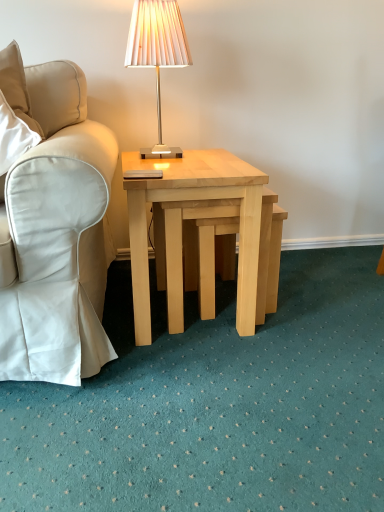
Find the location of a particular element. white fabric chair at left is located at coordinates (55, 228).

What do you see at coordinates (215, 258) in the screenshot?
I see `natural wood stool at center` at bounding box center [215, 258].

Measure the distance between light wood/natural wood coffee table at center and camera.

light wood/natural wood coffee table at center and camera are 3.74 feet apart from each other.

Where is `white fabric chair at left`? white fabric chair at left is located at coordinates (55, 228).

In the scene shown: Is matte beige lamp at upper center thinner than natural wood stool at center?

Yes, matte beige lamp at upper center is thinner than natural wood stool at center.

Visually, is matte beige lamp at upper center positioned to the left or to the right of natural wood stool at center?

In the image, matte beige lamp at upper center appears on the left side of natural wood stool at center.

Where is `lamp to the left of natural wood stool at center`? lamp to the left of natural wood stool at center is located at coordinates (157, 52).

From the image's perspective, which one is positioned higher, natural wood stool at center or white fabric chair at left?

white fabric chair at left, from the image's perspective.

Looking at this image, can you confirm if natural wood stool at center is positioned to the left of white fabric chair at left?

Incorrect, natural wood stool at center is not on the left side of white fabric chair at left.

Would you say natural wood stool at center is inside or outside white fabric chair at left?

natural wood stool at center is not inside white fabric chair at left, it's outside.

You are a GUI agent. You are given a task and a screenshot of the screen. Output one action in this format:
    pyautogui.click(x=<x>, y=<y>)
    Task: Click on the chair positioned vertically above the natural wood stool at center (from a real-world perspective)
    The width and height of the screenshot is (384, 512).
    Given the screenshot: What is the action you would take?
    pyautogui.click(x=55, y=228)

Is light wood/natural wood coffee table at center at the back of natural wood stool at center?

Yes.

From the picture: From the image's perspective, between natural wood stool at center and light wood/natural wood coffee table at center, which one is located above?

From the image's view, light wood/natural wood coffee table at center is above.

Locate an element on the screen. This screenshot has width=384, height=512. lamp above the light wood/natural wood coffee table at center (from the image's perspective) is located at coordinates (157, 52).

Is point (167, 41) farther from viewer compared to point (176, 167)?

Yes, it is.

Considering the sizes of objects matte beige lamp at upper center and light wood/natural wood coffee table at center in the image provided, who is bigger, matte beige lamp at upper center or light wood/natural wood coffee table at center?

Bigger between the two is light wood/natural wood coffee table at center.

From a real-world perspective, who is located higher, light wood/natural wood coffee table at center or matte beige lamp at upper center?

matte beige lamp at upper center, from a real-world perspective.

From their relative heights in the image, would you say light wood/natural wood coffee table at center is taller or shorter than matte beige lamp at upper center?

Considering their sizes, light wood/natural wood coffee table at center has more height than matte beige lamp at upper center.

Based on the photo, looking at the image, does light wood/natural wood coffee table at center seem bigger or smaller compared to matte beige lamp at upper center?

Considering their sizes, light wood/natural wood coffee table at center takes up more space than matte beige lamp at upper center.

Who is shorter, white fabric chair at left or matte beige lamp at upper center?

With less height is matte beige lamp at upper center.

Considering the sizes of objects white fabric chair at left and matte beige lamp at upper center in the image provided, who is smaller, white fabric chair at left or matte beige lamp at upper center?

Smaller between the two is matte beige lamp at upper center.

From a real-world perspective, who is located lower, natural wood stool at center or matte beige lamp at upper center?

In real-world perspective, natural wood stool at center is lower.

Measure the distance from natural wood stool at center to matte beige lamp at upper center.

26.15 inches.

From the picture: Which is more to the right, natural wood stool at center or matte beige lamp at upper center?

Positioned to the right is natural wood stool at center.

This screenshot has width=384, height=512. Find the location of `stool located underneath the matte beige lamp at upper center (from a real-world perspective)`. stool located underneath the matte beige lamp at upper center (from a real-world perspective) is located at coordinates (215, 258).

Find the location of a particular element. Image resolution: width=384 pixels, height=512 pixels. lamp above the natural wood stool at center (from the image's perspective) is located at coordinates (157, 52).

In order to click on chair lying in front of the natural wood stool at center in this screenshot , I will do point(55,228).

Looking at the image, which one is located further to white fabric chair at left, light wood/natural wood coffee table at center or matte beige lamp at upper center?

The object further to white fabric chair at left is matte beige lamp at upper center.

Based on their spatial positions, is white fabric chair at left or light wood/natural wood coffee table at center further from natural wood stool at center?

The object further to natural wood stool at center is white fabric chair at left.

Based on their spatial positions, is white fabric chair at left or natural wood stool at center closer to light wood/natural wood coffee table at center?

natural wood stool at center.

Looking at this image, when comparing their distances from natural wood stool at center, does matte beige lamp at upper center or light wood/natural wood coffee table at center seem further?

The object further to natural wood stool at center is matte beige lamp at upper center.

Which object lies nearer to the anchor point white fabric chair at left, matte beige lamp at upper center or light wood/natural wood coffee table at center?

light wood/natural wood coffee table at center.

Based on their spatial positions, is light wood/natural wood coffee table at center or natural wood stool at center closer to white fabric chair at left?

light wood/natural wood coffee table at center.

From the image, which object appears to be farther from light wood/natural wood coffee table at center, natural wood stool at center or matte beige lamp at upper center?

Based on the image, matte beige lamp at upper center appears to be further to light wood/natural wood coffee table at center.

From the image, which object appears to be farther from matte beige lamp at upper center, white fabric chair at left or natural wood stool at center?

The object further to matte beige lamp at upper center is natural wood stool at center.

The width and height of the screenshot is (384, 512). What are the coordinates of `lamp located between white fabric chair at left and natural wood stool at center in the left-right direction` in the screenshot? It's located at (157, 52).

The width and height of the screenshot is (384, 512). I want to click on coffee table situated between white fabric chair at left and natural wood stool at center from left to right, so click(196, 200).

Where is `coffee table between matte beige lamp at upper center and natural wood stool at center in the vertical direction`? The image size is (384, 512). coffee table between matte beige lamp at upper center and natural wood stool at center in the vertical direction is located at coordinates (196, 200).

The width and height of the screenshot is (384, 512). I want to click on lamp between white fabric chair at left and light wood/natural wood coffee table at center in the horizontal direction, so click(x=157, y=52).